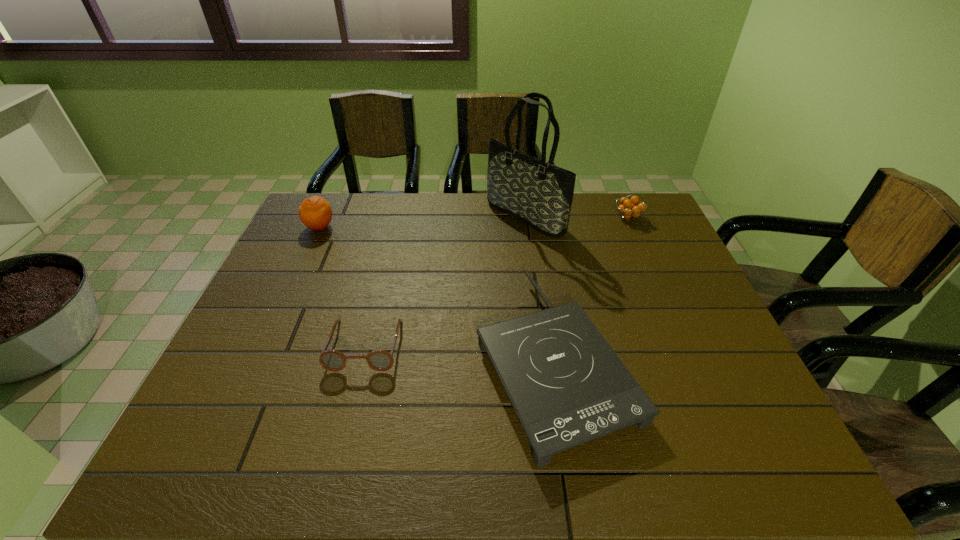
The width and height of the screenshot is (960, 540). Identify the location of free space between the right orange fruit and the hotplate. (591, 287).

Find the location of `unoccupied area between the tallest object and the fourth object from right to left`. unoccupied area between the tallest object and the fourth object from right to left is located at coordinates (445, 281).

In order to click on unoccupied position between the second object from left to right and the hotplate in this screenshot , I will do `click(460, 351)`.

Select which object appears as the third closest to the fourth object from right to left. Please provide its 2D coordinates. Your answer should be formatted as a tuple, i.e. [(x, y)], where the tuple contains the x and y coordinates of a point satisfying the conditions above.

[(540, 194)]

Select which object is the second closest to the tallest object. Please provide its 2D coordinates. Your answer should be formatted as a tuple, i.e. [(x, y)], where the tuple contains the x and y coordinates of a point satisfying the conditions above.

[(567, 386)]

Where is `free space in the image that satisfies the following two spatial constraints: 1. on the front-facing side of the hotplate; 2. on the left side of the second object from left to right`? free space in the image that satisfies the following two spatial constraints: 1. on the front-facing side of the hotplate; 2. on the left side of the second object from left to right is located at coordinates (362, 358).

I want to click on free space that satisfies the following two spatial constraints: 1. on the front-facing side of the spectacles; 2. on the left side of the hotplate, so click(362, 358).

Locate an element on the screen. The width and height of the screenshot is (960, 540). vacant point that satisfies the following two spatial constraints: 1. on the front-facing side of the fourth object from right to left; 2. on the right side of the hotplate is located at coordinates (362, 358).